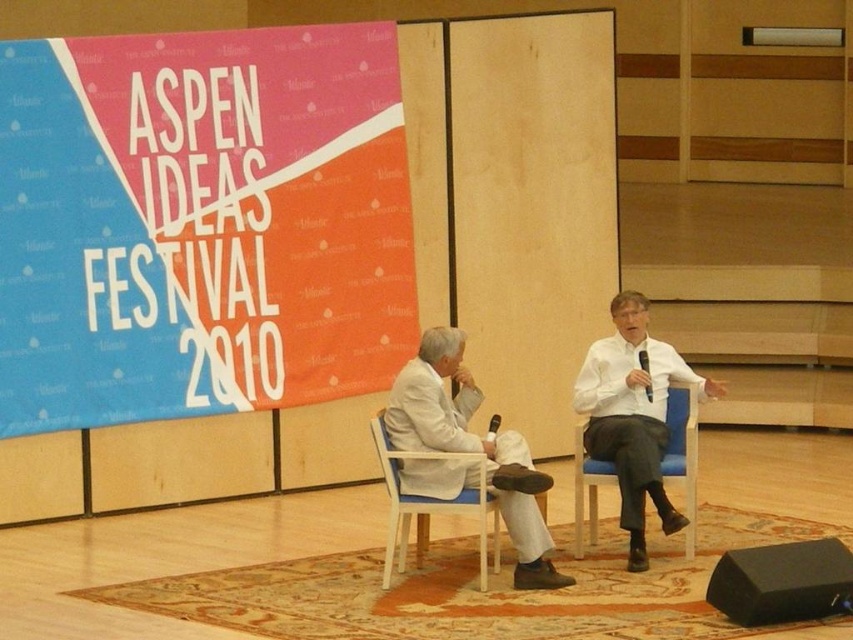
You are attending the Aspen Ideas Festival 2010 and see the white plastic chair at center and the blue fabric chair at right. Which chair is positioned to the left side of the other?

The white plastic chair at center is to the left of the blue fabric chair at right.

You are organizing an event and need to place a 7 feet long table between the black matte speaker at lower right and the white plastic chair at center. Can the table fit between them without overlapping either object?

The black matte speaker at lower right and white plastic chair at center are 6.91 feet apart from each other. Since the table is 7 feet long, it would not fit between them as the distance is slightly less than the table length.

You are an event organizer trying to arrange seating for a panel discussion. You have a white fabric suit at center and a white plastic chair at center. Which object should you consider for seating attendees?

The white plastic chair at center is the appropriate object for seating attendees, as chairs are designed for sitting while the white fabric suit at center is clothing and not meant for seating.